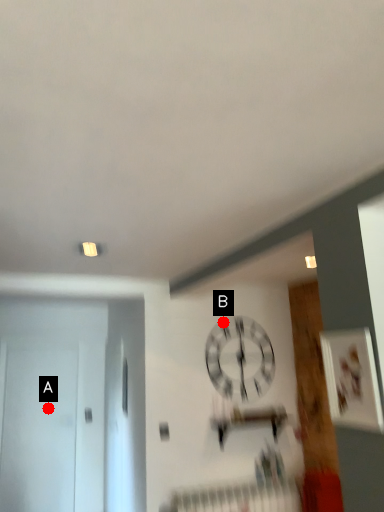
Question: Two points are circled on the image, labeled by A and B beside each circle. Which point is closer to the camera taking this photo?

Choices:
 (A) A is closer
 (B) B is closer

Answer: (B)